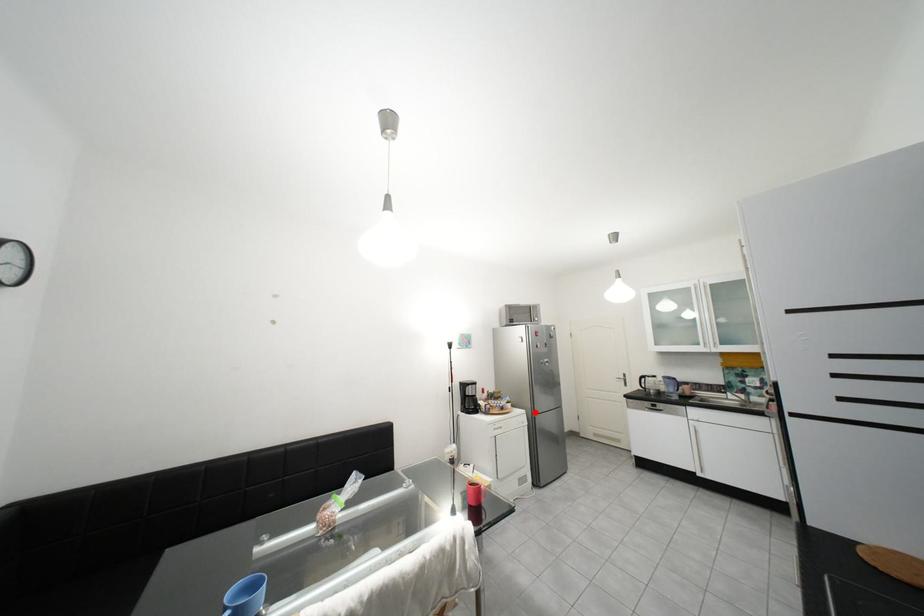
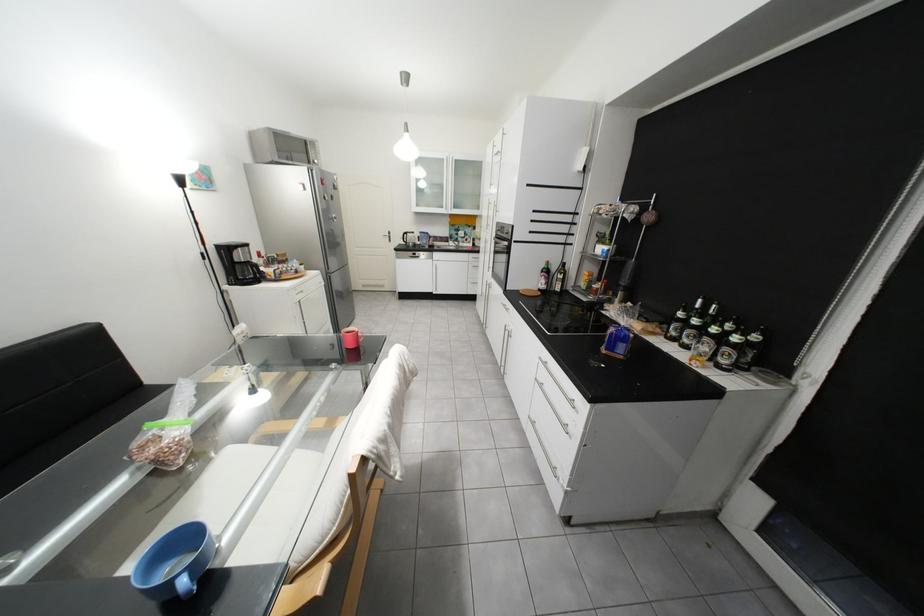
Where in the second image is the point corresponding to the highlighted location from the first image?

(330, 273)